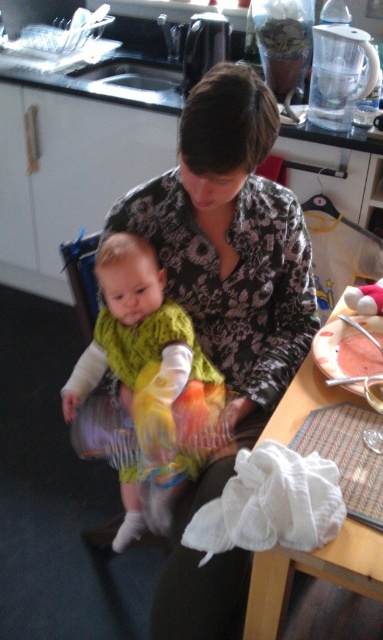
You are standing in the kitchen and see the black floral shirt at center and the multicolored fabric dress at center. Which one is positioned to the right side?

The black floral shirt at center is positioned to the right of the multicolored fabric dress at center.

You are a robot in the kitchen. You need to pick up the white cloth at lower right. Where exactly should you reach to grab it?

The white cloth at lower right is located at point [312,573], so you should reach there to grab it.

You are a photographer setting up a shoot in this kitchen scene. You need to position a light source so that it illuminates the black floral shirt at center without casting a shadow over the multicolored fabric dress at center. Given their spatial relationship, where should you place the light source relative to these two objects?

The black floral shirt at center is in front of the multicolored fabric dress at center. To avoid casting a shadow on the dress, place the light source directly behind the black floral shirt at center, facing towards the dress.